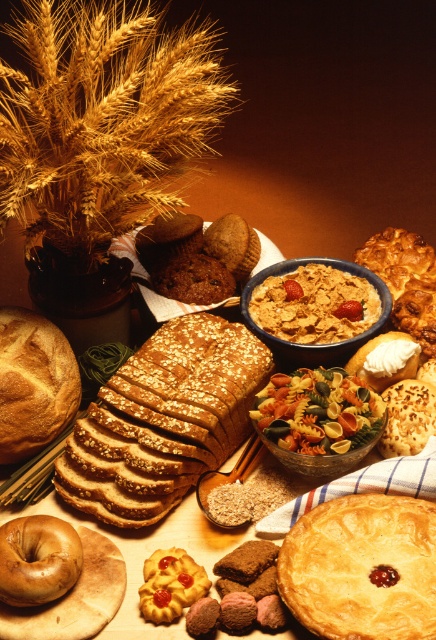
Question: Does golden flaky pie at center have a greater width compared to brown matte bagel at lower left?

Choices:
 (A) yes
 (B) no

Answer: (A)

Question: Can you confirm if golden flaky pie at center is positioned to the left of golden brown crusty loaf of bread at left?

Choices:
 (A) no
 (B) yes

Answer: (A)

Question: Which object is positioned closest to the golden flaky pie at center?

Choices:
 (A) brown matte bagel at lower left
 (B) golden brown crusty loaf of bread at left
 (C) brown crumbly biscuit at lower left
 (D) golden crusty loaf of bread at center

Answer: (D)

Question: Is brown crumbly biscuit at lower left in front of brown matte bagel at lower left?

Choices:
 (A) yes
 (B) no

Answer: (B)

Question: Which object is the farthest from the golden flaky pie at center?

Choices:
 (A) brown matte bagel at lower left
 (B) golden brown crusty loaf of bread at left

Answer: (B)

Question: Which point is farther to the camera?

Choices:
 (A) (146, 524)
 (B) (0, 330)
 (C) (3, 529)

Answer: (B)